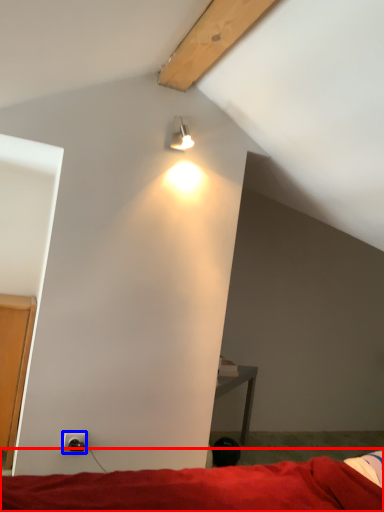
Question: Among these objects, which one is farthest to the camera, bed (highlighted by a red box) or power outlet (highlighted by a blue box)?

Choices:
 (A) bed
 (B) power outlet

Answer: (B)